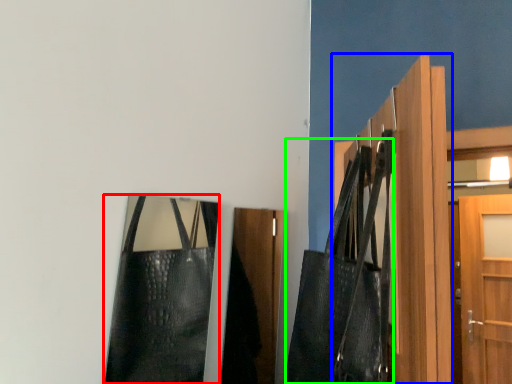
Question: Based on their relative distances, which object is farther from bag (highlighted by a red box)? Choose from door (highlighted by a blue box) and shoulder bag (highlighted by a green box).

Choices:
 (A) door
 (B) shoulder bag

Answer: (A)